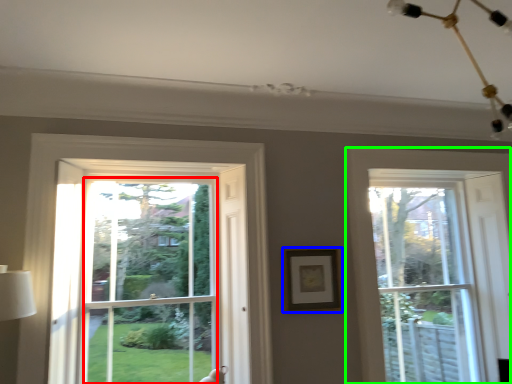
Question: Based on their relative distances, which object is farther from window screen (highlighted by a red box)? Choose from picture frame (highlighted by a blue box) and window (highlighted by a green box).

Choices:
 (A) picture frame
 (B) window

Answer: (B)